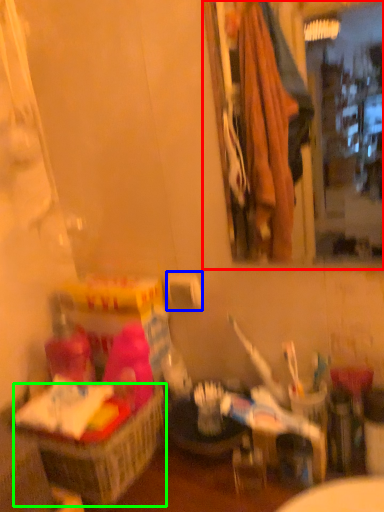
Question: Based on their relative distances, which object is farther from mirror (highlighted by a red box)? Choose from toilet paper (highlighted by a blue box) and basket (highlighted by a green box).

Choices:
 (A) toilet paper
 (B) basket

Answer: (B)